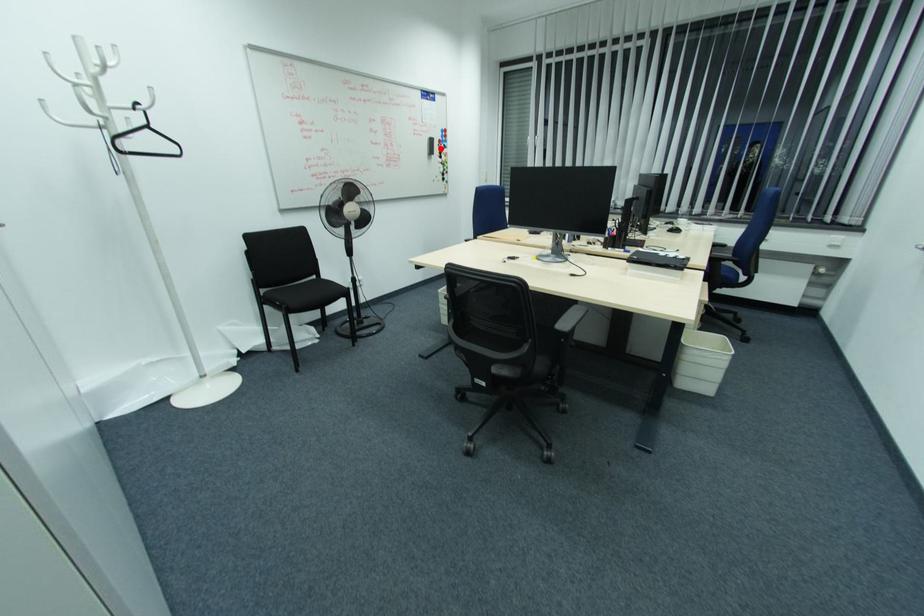
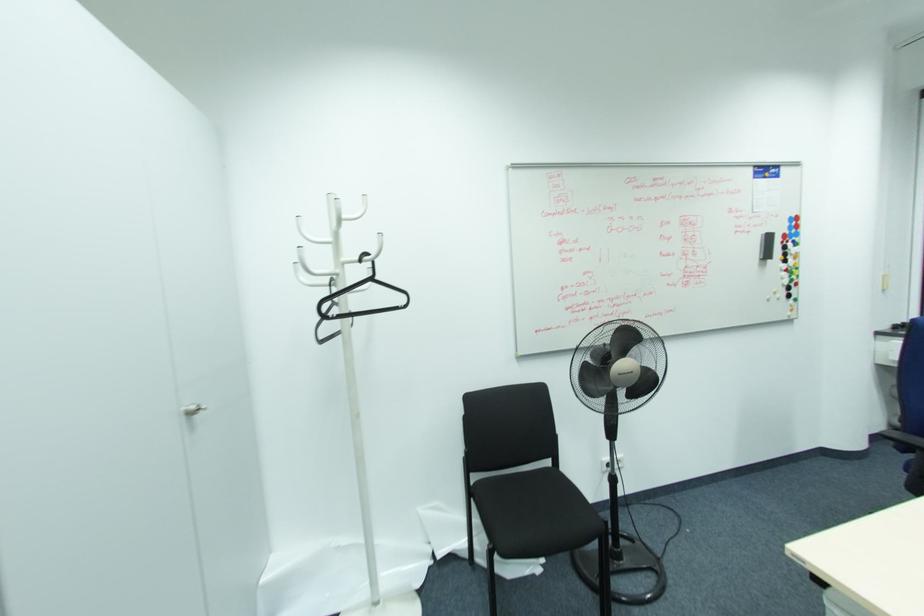
Question: I am providing you with two images of the same scene from different viewpoints. A red point is shown in image1. For the corresponding object point in image2, is it positioned nearer or farther from the camera?

Choices:
 (A) Nearer
 (B) Farther

Answer: (B)